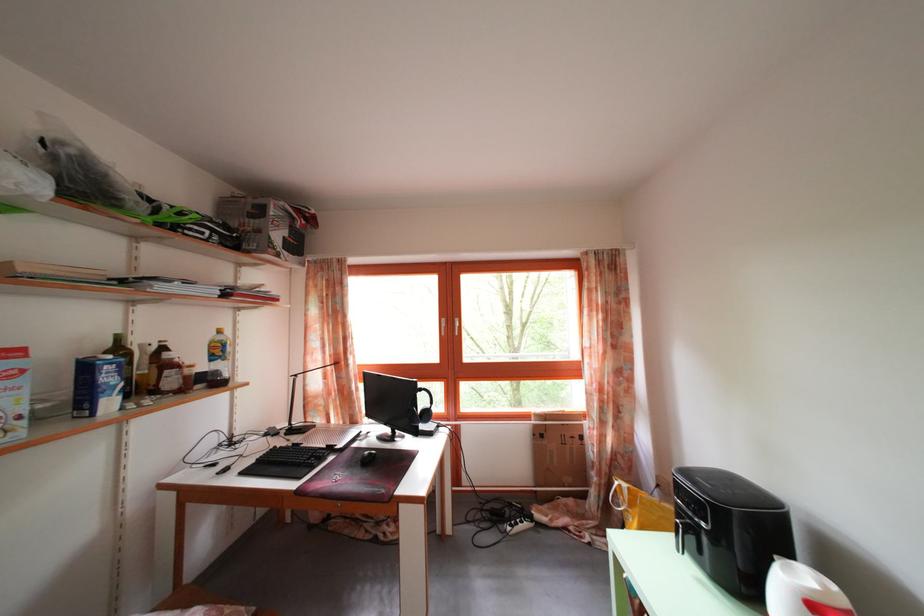
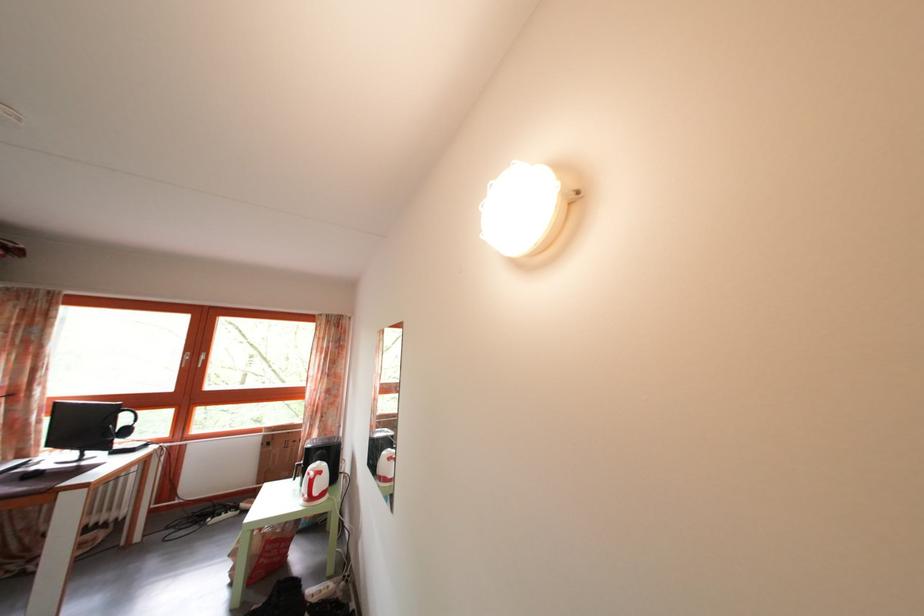
The point at [430,434] is marked in the first image. Where is the corresponding point in the second image?

(128, 451)